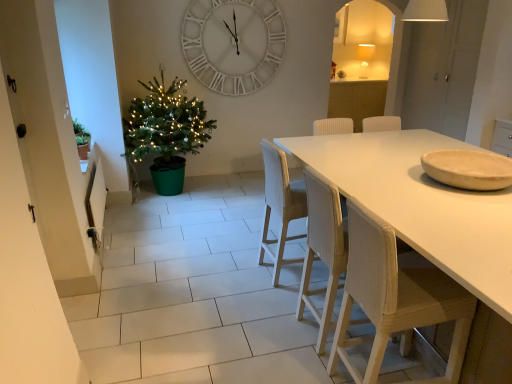
Question: From a real-world perspective, is white woven chair at center, arranged as the 2th chair when viewed from the back, positioned above or below green matte plant at left?

Choices:
 (A) below
 (B) above

Answer: (A)

Question: Is white woven chair at center, arranged as the 2th chair when viewed from the back, spatially inside green matte plant at left, or outside of it?

Choices:
 (A) inside
 (B) outside

Answer: (B)

Question: Estimate the real-world distances between objects in this image. Which object is farther from the white woven chair at center, arranged as the 2th chair when viewed from the back?

Choices:
 (A) woven wood chair at center, which is counted as the 3th chair, starting from the front
 (B) white wooden clock at upper center
 (C) wooden bowl at right
 (D) green matte plant at left
 (E) wooden textured chair at right, acting as the 3th chair starting from the back

Answer: (B)

Question: Estimate the real-world distances between objects in this image. Which object is farther from the wooden textured chair at right, the first chair from the front?

Choices:
 (A) white woven chair at center, arranged as the 2th chair when viewed from the back
 (B) green matte plant at left
 (C) wooden bowl at right
 (D) woven wood chair at center, which is counted as the 3th chair, starting from the front
 (E) green matte christmas tree at left

Answer: (E)